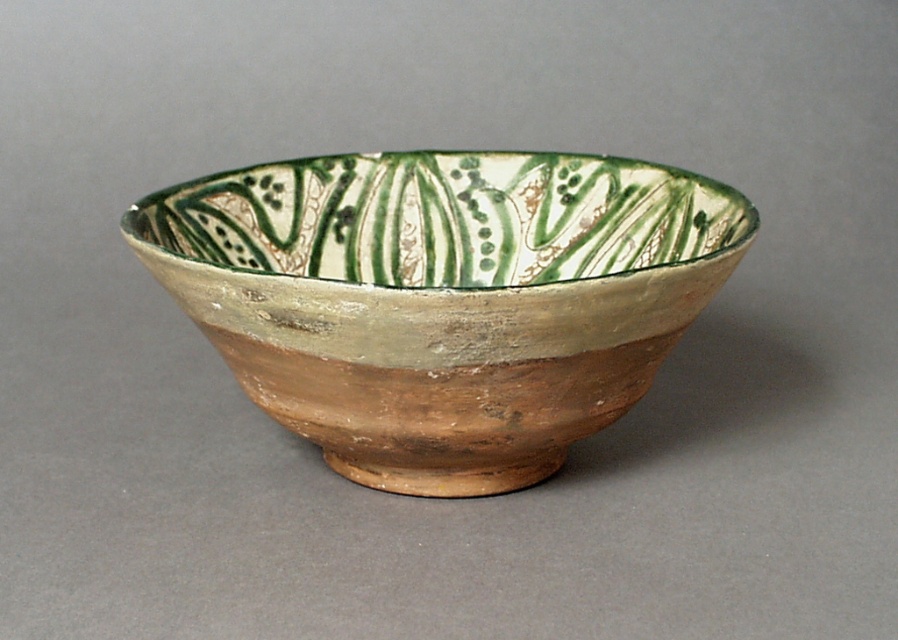
Question: Can you confirm if matte clay bowl at center is smaller than green glazed bowl at center?

Choices:
 (A) no
 (B) yes

Answer: (A)

Question: Is matte clay bowl at center bigger than green glazed bowl at center?

Choices:
 (A) yes
 (B) no

Answer: (A)

Question: Does matte clay bowl at center come behind green glazed bowl at center?

Choices:
 (A) yes
 (B) no

Answer: (B)

Question: Which of the following is the farthest from the observer?

Choices:
 (A) (514, 220)
 (B) (644, 244)

Answer: (A)